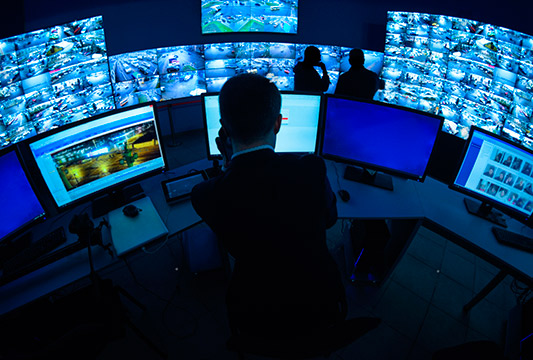
Where is `computer monitors`? The image size is (533, 360). computer monitors is located at coordinates click(95, 156), click(209, 115), click(384, 132), click(492, 171).